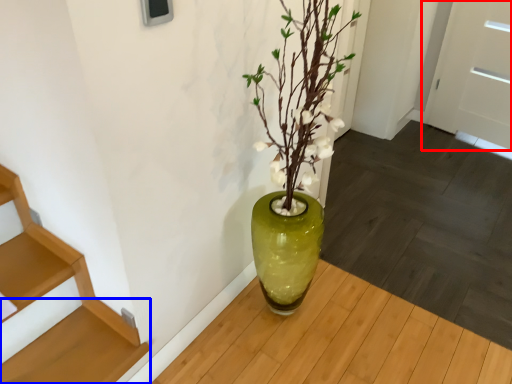
Question: Which object is further to the camera taking this photo, door (highlighted by a red box) or stairs (highlighted by a blue box)?

Choices:
 (A) door
 (B) stairs

Answer: (A)